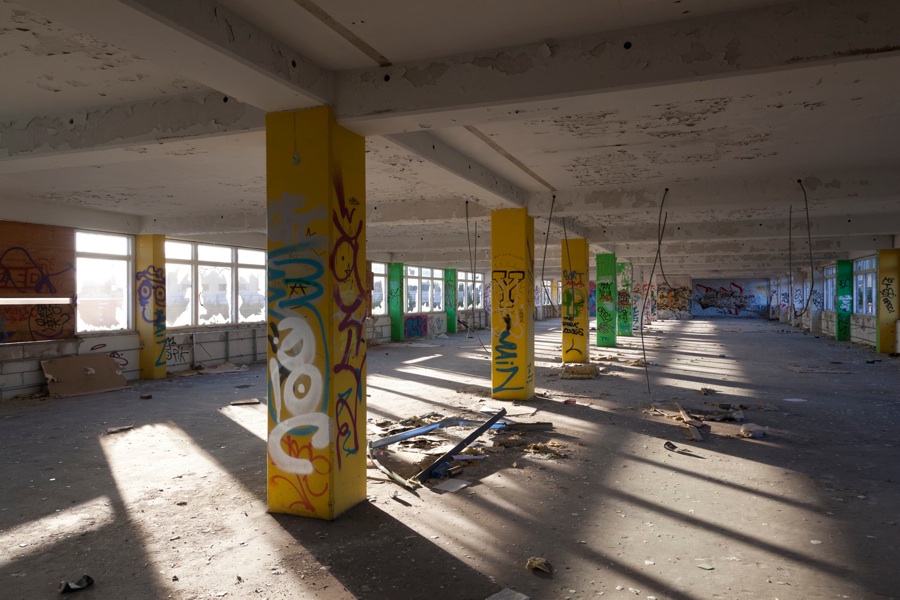
This screenshot has width=900, height=600. What are the coordinates of `the closest pillar` in the screenshot? It's located at (292, 354).